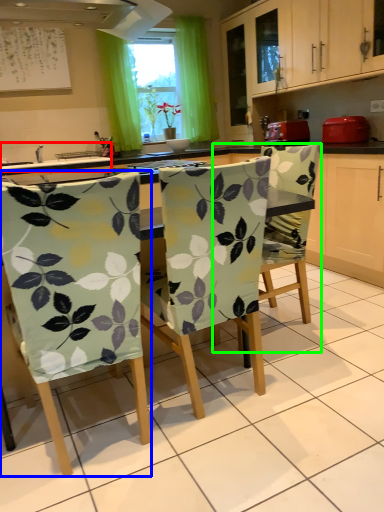
Question: Which is nearer to the sink (highlighted by a red box)? chair (highlighted by a blue box) or chair (highlighted by a green box).

Choices:
 (A) chair
 (B) chair

Answer: (B)